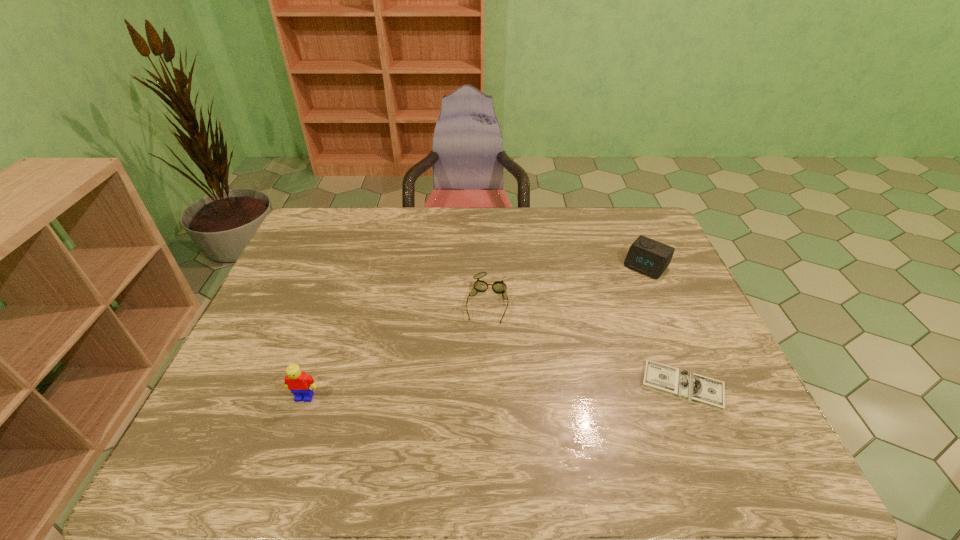
Where is `Lego`? Lego is located at coordinates (300, 384).

Locate an element on the screen. The height and width of the screenshot is (540, 960). the leftmost object is located at coordinates (300, 384).

You are a GUI agent. You are given a task and a screenshot of the screen. Output one action in this format:
    pyautogui.click(x=<x>, y=<y>)
    Task: Click on the shortest object
    This screenshot has width=960, height=540.
    Given the screenshot: What is the action you would take?
    pyautogui.click(x=709, y=392)

This screenshot has height=540, width=960. I want to click on the second shortest object, so pos(499,287).

Where is `spectacles`? Image resolution: width=960 pixels, height=540 pixels. spectacles is located at coordinates click(x=499, y=287).

At what (x,y) coordinates should I click in order to perform the action: click on the third shortest object. Please return your answer as a coordinate pair (x, y). The image size is (960, 540). Looking at the image, I should click on (646, 256).

Locate an element on the screen. The height and width of the screenshot is (540, 960). vacant space located 0.400m on the back of the dollar is located at coordinates (631, 261).

Locate an element on the screen. free spot located on the front-facing side of the second shortest object is located at coordinates (469, 408).

What are the coordinates of `vacant area situated on the front-facing side of the second shortest object` in the screenshot? It's located at (480, 350).

The width and height of the screenshot is (960, 540). I want to click on vacant region located 0.280m on the front-facing side of the second shortest object, so click(x=468, y=416).